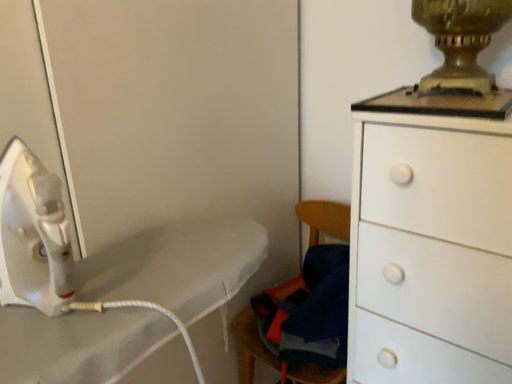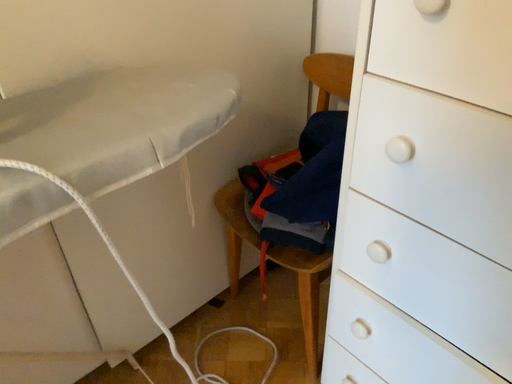
Question: Which way did the camera rotate in the video?

Choices:
 (A) rotated downward
 (B) rotated upward

Answer: (A)